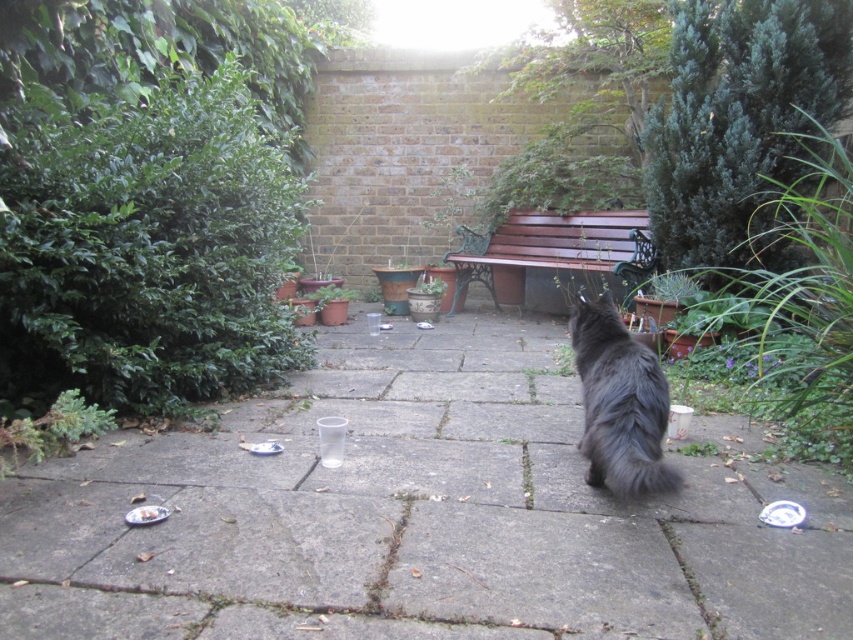
Is point (619, 452) positioned behind point (511, 240)?

No.

Can you confirm if black fluffy cat at center is positioned below wooden bench at center?

Yes, black fluffy cat at center is below wooden bench at center.

The width and height of the screenshot is (853, 640). I want to click on black fluffy cat at center, so click(619, 403).